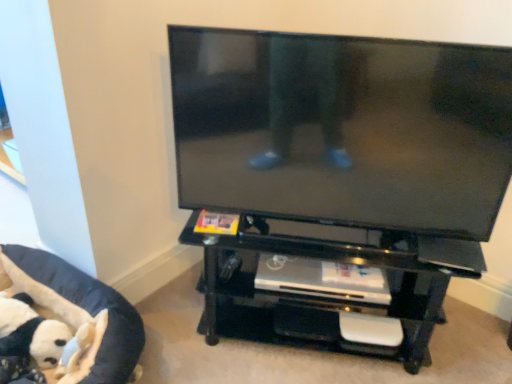
Question: Is black glossy flat-screen tv at center at the back of black glossy entertainment center at center?

Choices:
 (A) yes
 (B) no

Answer: (B)

Question: Considering the relative sizes of black glossy entertainment center at center and black glossy flat-screen tv at center in the image provided, is black glossy entertainment center at center bigger than black glossy flat-screen tv at center?

Choices:
 (A) no
 (B) yes

Answer: (B)

Question: From the image's perspective, is black glossy entertainment center at center located above black glossy flat-screen tv at center?

Choices:
 (A) yes
 (B) no

Answer: (B)

Question: Could you tell me if black glossy entertainment center at center is turned towards black glossy flat-screen tv at center?

Choices:
 (A) yes
 (B) no

Answer: (B)

Question: Is black glossy entertainment center at center taller than black glossy flat-screen tv at center?

Choices:
 (A) yes
 (B) no

Answer: (B)

Question: Considering the relative positions of black glossy entertainment center at center and black glossy flat-screen tv at center in the image provided, is black glossy entertainment center at center to the right of black glossy flat-screen tv at center from the viewer's perspective?

Choices:
 (A) yes
 (B) no

Answer: (A)

Question: Is black glossy entertainment center at center not near black fabric pet bed at lower left?

Choices:
 (A) yes
 (B) no

Answer: (B)

Question: Does black glossy entertainment center at center come in front of black fabric pet bed at lower left?

Choices:
 (A) yes
 (B) no

Answer: (B)

Question: From a real-world perspective, does black glossy entertainment center at center sit lower than black fabric pet bed at lower left?

Choices:
 (A) yes
 (B) no

Answer: (B)

Question: Is black glossy entertainment center at center aimed at black fabric pet bed at lower left?

Choices:
 (A) no
 (B) yes

Answer: (A)

Question: Is black glossy entertainment center at center shorter than black fabric pet bed at lower left?

Choices:
 (A) no
 (B) yes

Answer: (A)

Question: Is black glossy entertainment center at center to the right of black fabric pet bed at lower left from the viewer's perspective?

Choices:
 (A) yes
 (B) no

Answer: (A)

Question: Does black glossy flat-screen tv at center appear on the right side of black fabric pet bed at lower left?

Choices:
 (A) yes
 (B) no

Answer: (A)